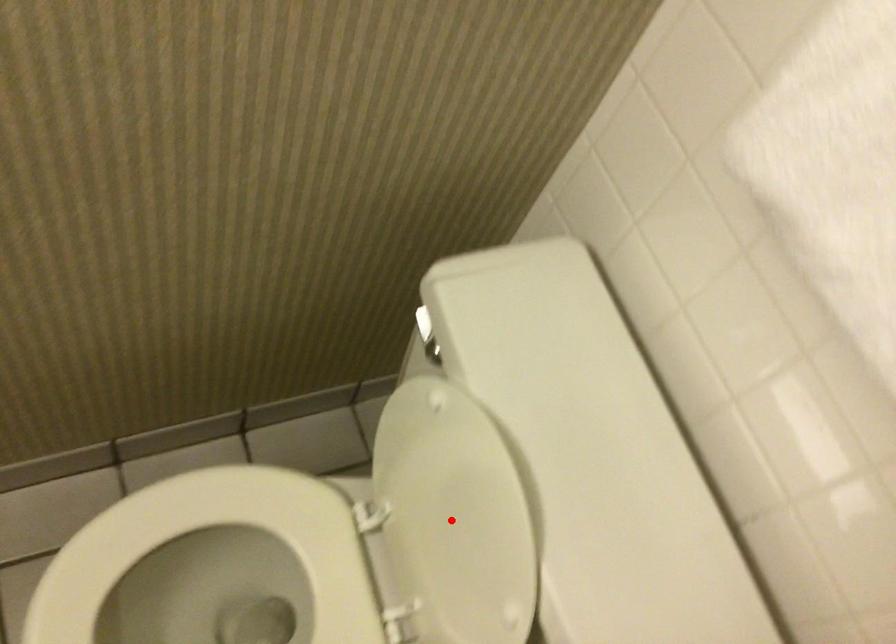
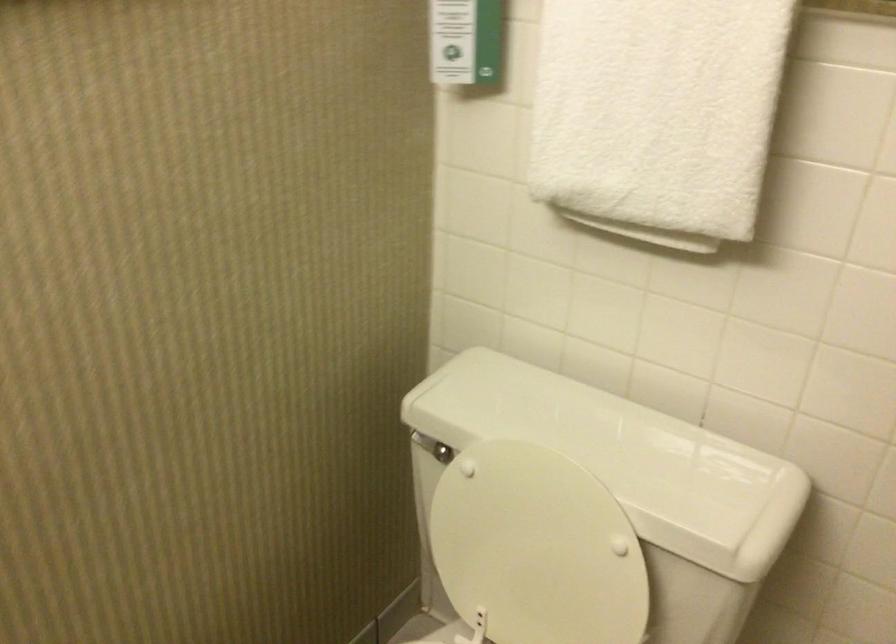
Question: I am providing you with two images of the same scene from different viewpoints. Image1 has a red point marked. In image2, the corresponding 3D location appears at what relative position? Reply with the corresponding letter.

Choices:
 (A) Closer
 (B) Farther

Answer: (B)